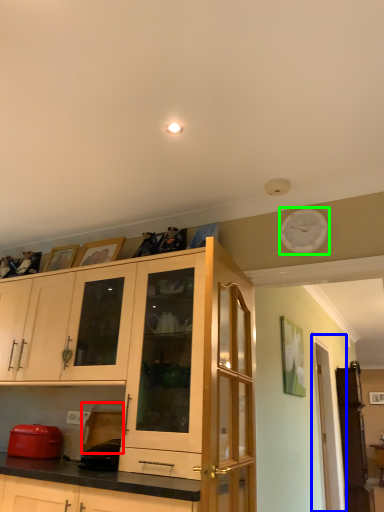
Question: Based on their relative distances, which object is nearer to appliance (highlighted by a red box)? Choose from glass door (highlighted by a blue box) and clock (highlighted by a green box).

Choices:
 (A) glass door
 (B) clock

Answer: (B)